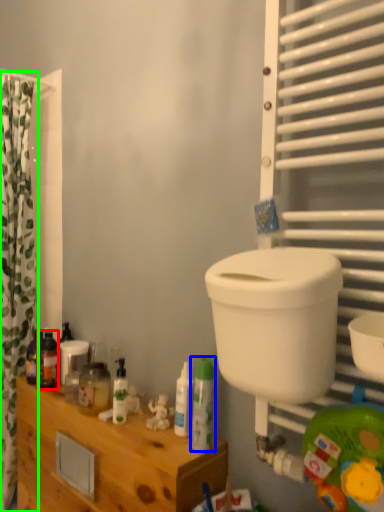
Question: Estimate the real-world distances between objects in this image. Which object is farther from toiletry (highlighted by a red box), toiletry (highlighted by a blue box) or curtain (highlighted by a green box)?

Choices:
 (A) toiletry
 (B) curtain

Answer: (A)